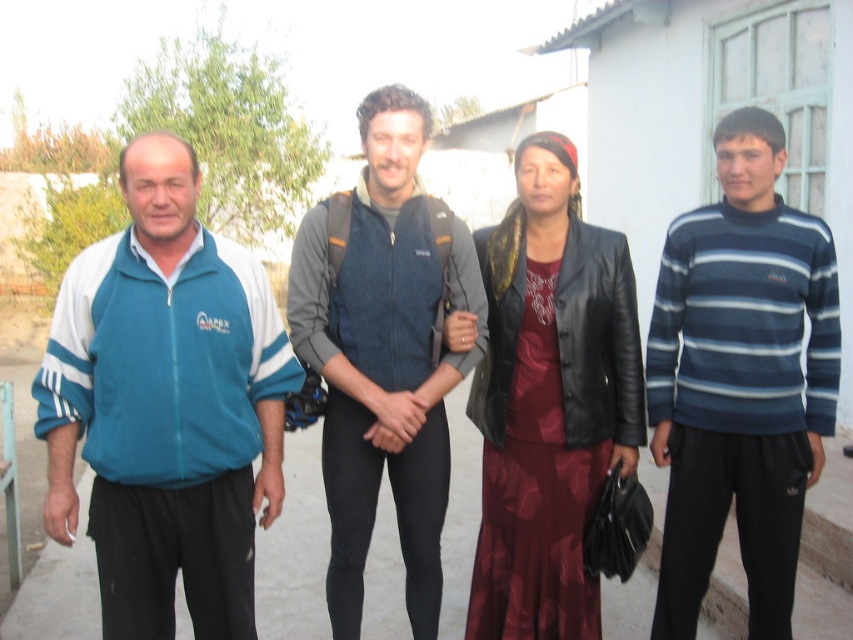
Question: Is blue striped sweater at right further to camera compared to leather jacket at center?

Choices:
 (A) yes
 (B) no

Answer: (B)

Question: Considering the real-world distances, which object is closest to the teal fabric jacket at left?

Choices:
 (A) leather jacket at center
 (B) blue striped sweater at right
 (C) denim jacket at center

Answer: (C)

Question: Observing the image, what is the correct spatial positioning of blue striped sweater at right in reference to denim jacket at center?

Choices:
 (A) right
 (B) left

Answer: (A)

Question: Which point is closer to the camera?

Choices:
 (A) denim jacket at center
 (B) leather jacket at center

Answer: (A)

Question: Which point is farther to the camera?

Choices:
 (A) leather jacket at center
 (B) teal fabric jacket at left
 (C) denim jacket at center
 (D) blue striped sweater at right

Answer: (A)

Question: From the image, what is the correct spatial relationship of leather jacket at center in relation to denim jacket at center?

Choices:
 (A) below
 (B) above

Answer: (A)